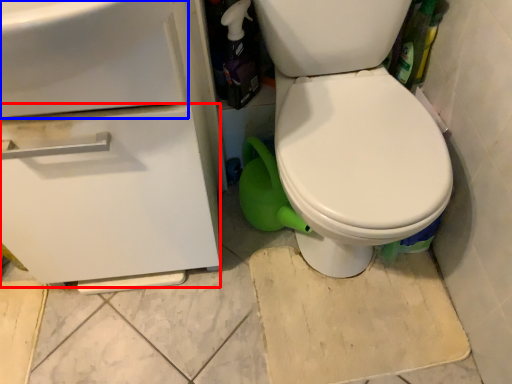
Question: Which object is closer to the camera taking this photo, drawer (highlighted by a red box) or sink (highlighted by a blue box)?

Choices:
 (A) drawer
 (B) sink

Answer: (B)